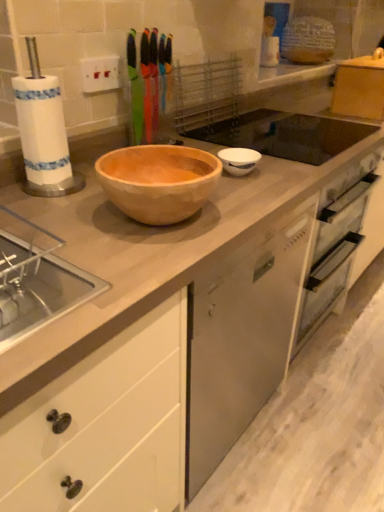
Question: From a real-world perspective, is black glass sink at upper center under white glossy bowl at center?

Choices:
 (A) no
 (B) yes

Answer: (B)

Question: Is the depth of black glass sink at upper center greater than that of white glossy bowl at center?

Choices:
 (A) no
 (B) yes

Answer: (B)

Question: Is black glass sink at upper center oriented away from white glossy bowl at center?

Choices:
 (A) yes
 (B) no

Answer: (B)

Question: Is black glass sink at upper center bigger than white glossy bowl at center?

Choices:
 (A) yes
 (B) no

Answer: (A)

Question: Does black glass sink at upper center have a greater width compared to white glossy bowl at center?

Choices:
 (A) yes
 (B) no

Answer: (A)

Question: Is black glass sink at upper center positioned beyond the bounds of white glossy bowl at center?

Choices:
 (A) yes
 (B) no

Answer: (A)

Question: Is white glossy bowl at center oriented towards black glass sink at upper center?

Choices:
 (A) yes
 (B) no

Answer: (B)

Question: From a real-world perspective, is white glossy bowl at center located higher than black glass sink at upper center?

Choices:
 (A) no
 (B) yes

Answer: (B)

Question: Is white glossy bowl at center bigger than black glass sink at upper center?

Choices:
 (A) yes
 (B) no

Answer: (B)

Question: Can you confirm if white glossy bowl at center is wider than black glass sink at upper center?

Choices:
 (A) yes
 (B) no

Answer: (B)

Question: Is white glossy bowl at center taller than black glass sink at upper center?

Choices:
 (A) yes
 (B) no

Answer: (A)

Question: Is white glossy bowl at center thinner than black glass sink at upper center?

Choices:
 (A) yes
 (B) no

Answer: (A)

Question: From a real-world perspective, is black glass sink at upper center physically located above or below white glossy bowl at center?

Choices:
 (A) above
 (B) below

Answer: (B)